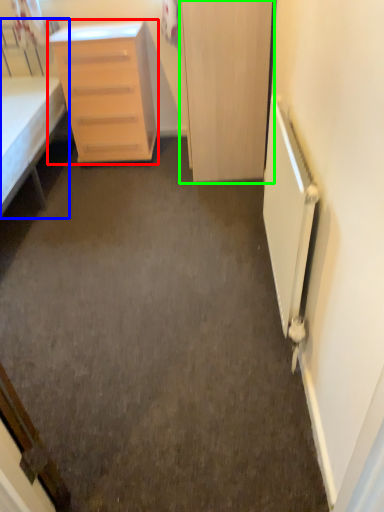
Question: Based on their relative distances, which object is farther from chest of drawers (highlighted by a red box)? Choose from bed (highlighted by a blue box) and door (highlighted by a green box).

Choices:
 (A) bed
 (B) door

Answer: (B)